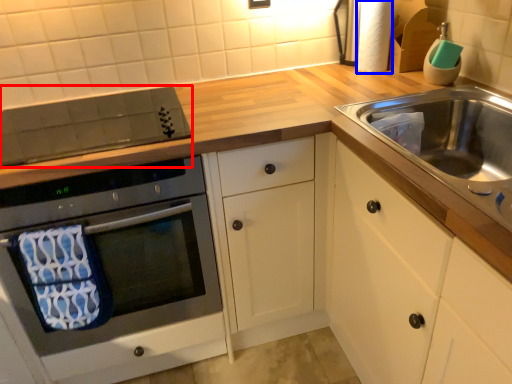
Question: Which object appears farthest to the camera in this image, appliance (highlighted by a red box) or toilet paper (highlighted by a blue box)?

Choices:
 (A) appliance
 (B) toilet paper

Answer: (B)